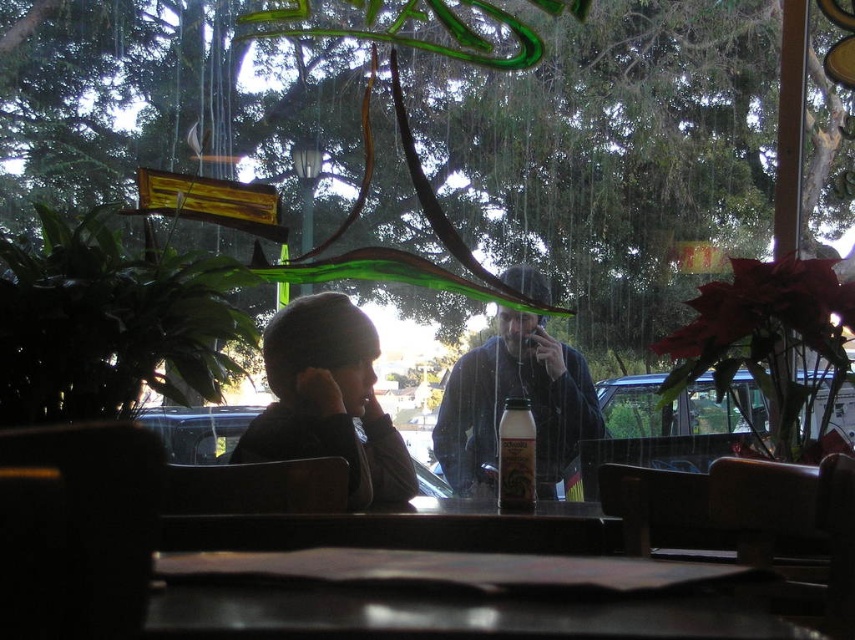
Does point (543, 481) come closer to viewer compared to point (513, 477)?

That is False.

Where is `dark blue sweater at center`? dark blue sweater at center is located at coordinates coord(514,396).

Between point (463, 451) and point (510, 481), which one is positioned in front?

Point (510, 481)

Find the location of a particular element. The height and width of the screenshot is (640, 855). dark blue sweater at center is located at coordinates (514, 396).

Does dark gray knit hat at left appear under dark blue sweater at center?

No, dark gray knit hat at left is not below dark blue sweater at center.

Between dark gray knit hat at left and dark blue sweater at center, which one appears on the right side from the viewer's perspective?

From the viewer's perspective, dark blue sweater at center appears more on the right side.

Between point (315, 390) and point (473, 464), which one is positioned in front?

Positioned in front is point (315, 390).

I want to click on dark gray knit hat at left, so click(x=328, y=400).

Consider the image. Who is higher up, smooth wooden table at center or dark blue sweater at center?

smooth wooden table at center

Is smooth wooden table at center bigger than dark blue sweater at center?

No.

Does point (258, 620) come closer to viewer compared to point (504, 353)?

Yes, point (258, 620) is in front of point (504, 353).

This screenshot has width=855, height=640. Find the location of `smooth wooden table at center`. smooth wooden table at center is located at coordinates (447, 596).